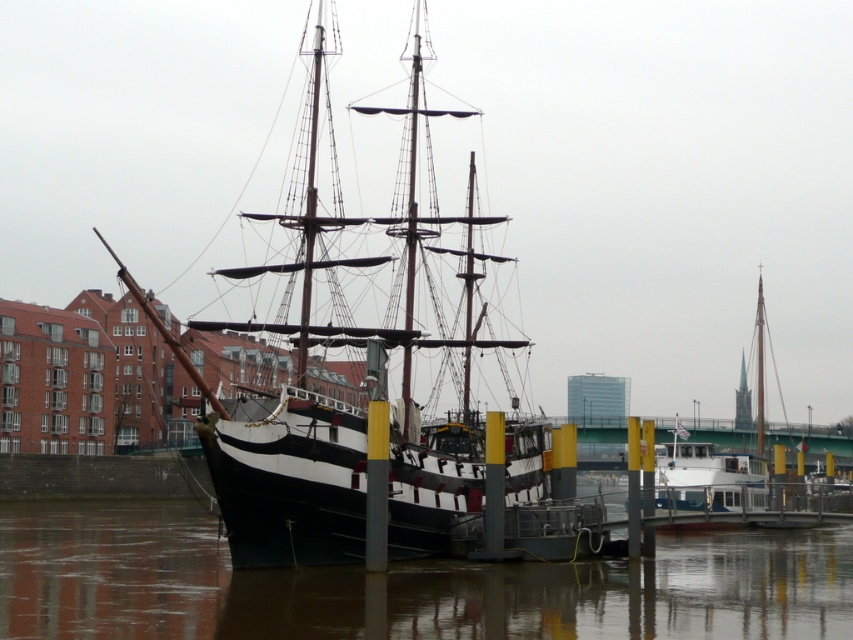
You are standing on the pier and notice a specific point marked at coordinates (378,259). Based on the scene, what object is located at that point?

The point at coordinates (378,259) corresponds to the black polished wood ship at center.

Consider the image. You are standing on the pier and see the brown water at lower center and the white matte sailboat at right. Which object appears taller from your perspective?

The white matte sailboat at right appears taller than the brown water at lower center because the brown water at lower center is shorter than the white matte sailboat at right.

You are standing on the pier and see the point marked at coordinates (641, 592). Based on the scene, where is this point located?

The point is on brown water at lower center.